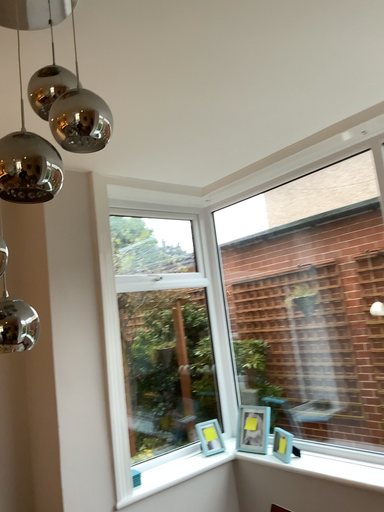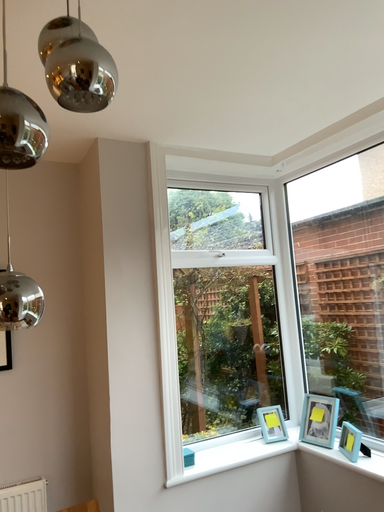
Question: Which way did the camera rotate in the video?

Choices:
 (A) rotated left
 (B) rotated right

Answer: (A)